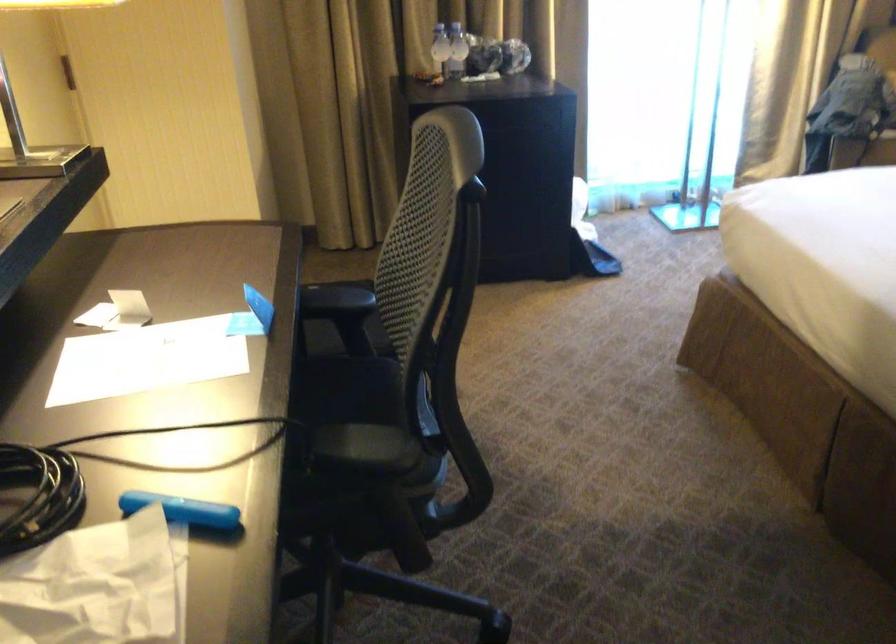
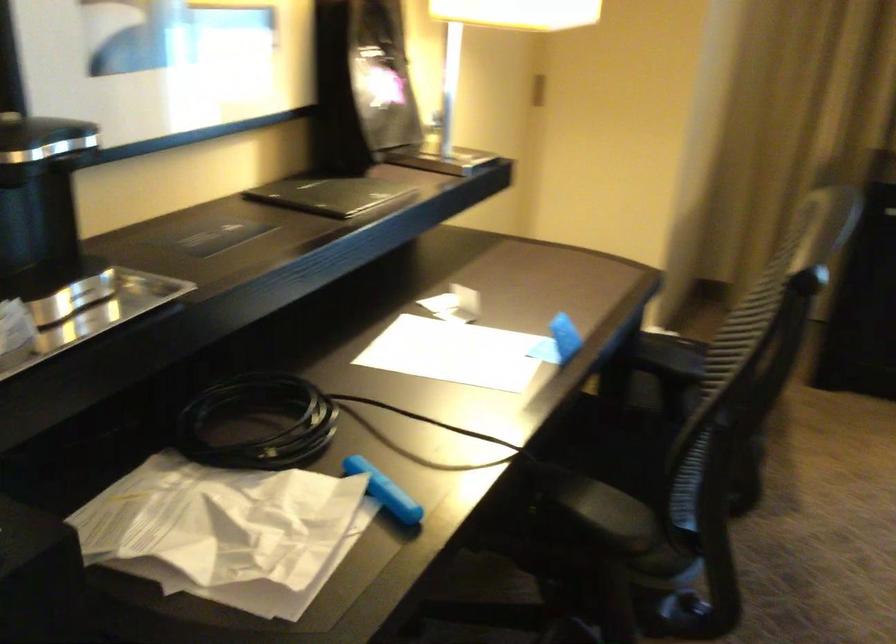
In the second image, find the point that corresponds to pixel 177 507 in the first image.

(384, 491)